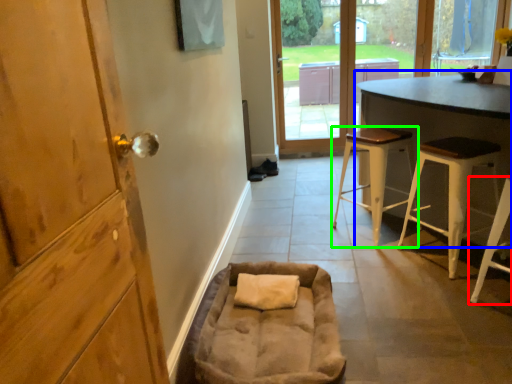
Question: Considering the real-world distances, which object is closest to stool (highlighted by a red box)? table (highlighted by a blue box) or stool (highlighted by a green box).

Choices:
 (A) table
 (B) stool

Answer: (A)